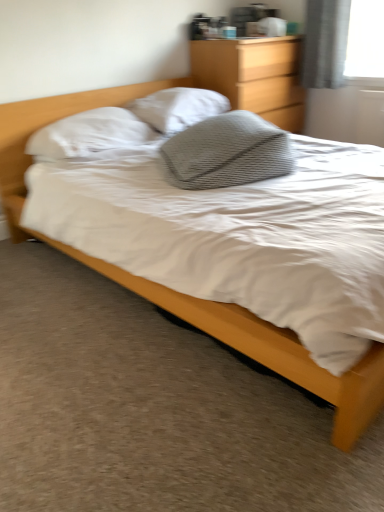
Locate an element on the screen. This screenshot has width=384, height=512. white textured pillow at center, arranged as the 1th pillow when viewed from the back is located at coordinates (178, 108).

From the image's perspective, is white textured pillow at center, which is the 3th pillow in front-to-back order, on matte wood bed at center?

Yes, from the image's perspective, white textured pillow at center, which is the 3th pillow in front-to-back order, is above matte wood bed at center.

There is a matte wood bed at center. Where is `the 3rd pillow above it (from a real-world perspective)`? Image resolution: width=384 pixels, height=512 pixels. the 3rd pillow above it (from a real-world perspective) is located at coordinates (178, 108).

Between white textured pillow at center, arranged as the 1th pillow when viewed from the back, and matte wood bed at center, which one is positioned in front?

matte wood bed at center is in front.

Between point (200, 89) and point (297, 344), which one is positioned in front?

Positioned in front is point (297, 344).

Is gray textured pillow at center, which is counted as the 1th pillow, starting from the front, located outside matte wood bed at center?

No, most part of gray textured pillow at center, which is counted as the 1th pillow, starting from the front, lies within matte wood bed at center.

From the image's perspective, relative to matte wood bed at center, is gray textured pillow at center, the third pillow when ordered from back to front, above or below?

gray textured pillow at center, the third pillow when ordered from back to front, is situated higher than matte wood bed at center in the image.

From a real-world perspective, is gray textured pillow at center, the third pillow when ordered from back to front, positioned over matte wood bed at center based on gravity?

Yes, from a real-world perspective, gray textured pillow at center, the third pillow when ordered from back to front, is on top of matte wood bed at center.

Is the depth of gray textured pillow at center, the third pillow when ordered from back to front, greater than that of matte wood bed at center?

Yes, the depth of gray textured pillow at center, the third pillow when ordered from back to front, is greater than that of matte wood bed at center.

Are matte wood bed at center and white textured pillow at center, arranged as the 1th pillow when viewed from the back, located far from each other?

Indeed, matte wood bed at center is not near white textured pillow at center, arranged as the 1th pillow when viewed from the back.

From a real-world perspective, which object stands above the other?

white textured pillow at center, which is the 3th pillow in front-to-back order, is physically above.

Is matte wood bed at center to the left of white textured pillow at center, which is the 3th pillow in front-to-back order, from the viewer's perspective?

No, matte wood bed at center is not to the left of white textured pillow at center, which is the 3th pillow in front-to-back order.

What's the angular difference between wooden dresser at upper center and gray textured pillow at center, which is counted as the 1th pillow, starting from the front,'s facing directions?

They differ by 20 degrees in their facing directions.

Is gray textured pillow at center, which is counted as the 1th pillow, starting from the front, completely or partially inside wooden dresser at upper center?

No.

Between wooden dresser at upper center and gray textured pillow at center, which is counted as the 1th pillow, starting from the front, which one has smaller width?

With smaller width is wooden dresser at upper center.

Is wooden dresser at upper center turned away from gray textured pillow at center, which is counted as the 1th pillow, starting from the front?

That's not correct — wooden dresser at upper center is not looking away from gray textured pillow at center, which is counted as the 1th pillow, starting from the front.

Which is farther from the camera, (191, 312) or (175, 139)?

The point (175, 139) is behind.

From a real-world perspective, is matte wood bed at center positioned over gray textured pillow at center, the third pillow when ordered from back to front, based on gravity?

Actually, matte wood bed at center is physically below gray textured pillow at center, the third pillow when ordered from back to front, in the real world.

Looking at this image, considering the relative sizes of matte wood bed at center and gray textured pillow at center, the third pillow when ordered from back to front, in the image provided, is matte wood bed at center bigger than gray textured pillow at center, the third pillow when ordered from back to front,?

Indeed, matte wood bed at center has a larger size compared to gray textured pillow at center, the third pillow when ordered from back to front.

This screenshot has width=384, height=512. Identify the location of bed beneath the gray textured pillow at center, which is counted as the 1th pillow, starting from the front (from a real-world perspective). (186, 295).

Could you tell me if gray textured pillow at center, the third pillow when ordered from back to front, is facing wooden dresser at upper center?

No, gray textured pillow at center, the third pillow when ordered from back to front, is not aimed at wooden dresser at upper center.

Which of these two, gray textured pillow at center, which is counted as the 1th pillow, starting from the front, or wooden dresser at upper center, is bigger?

wooden dresser at upper center is bigger.

Can you confirm if gray textured pillow at center, which is counted as the 1th pillow, starting from the front, is thinner than wooden dresser at upper center?

Incorrect, the width of gray textured pillow at center, which is counted as the 1th pillow, starting from the front, is not less than that of wooden dresser at upper center.

What's the angular difference between gray textured pillow at center, the third pillow when ordered from back to front, and wooden dresser at upper center's facing directions?

There is a 20-degree angle between the facing directions of gray textured pillow at center, the third pillow when ordered from back to front, and wooden dresser at upper center.

Can you tell me how much matte wood bed at center and wooden dresser at upper center differ in facing direction?

matte wood bed at center and wooden dresser at upper center are facing 0.83 degrees away from each other.

Who is smaller, matte wood bed at center or wooden dresser at upper center?

wooden dresser at upper center.

Which is in front, point (48, 116) or point (296, 110)?

The point (48, 116) is more forward.

In terms of width, does matte wood bed at center look wider or thinner when compared to wooden dresser at upper center?

matte wood bed at center is wider than wooden dresser at upper center.

Locate an element on the screen. The height and width of the screenshot is (512, 384). bed lying below the white textured pillow at center, arranged as the 1th pillow when viewed from the back (from the image's perspective) is located at coordinates (186, 295).

Identify the location of bed below the gray textured pillow at center, the third pillow when ordered from back to front (from a real-world perspective). (186, 295).

When comparing their distances from white soft pillow at upper left, which is counted as the 2th pillow, starting from the back, does gray textured pillow at center, the third pillow when ordered from back to front, or matte wood bed at center seem further?

Among the two, matte wood bed at center is located further to white soft pillow at upper left, which is counted as the 2th pillow, starting from the back.

When comparing their distances from wooden dresser at upper center, does matte wood bed at center or white textured pillow at center, arranged as the 1th pillow when viewed from the back, seem further?

Among the two, matte wood bed at center is located further to wooden dresser at upper center.

Estimate the real-world distances between objects in this image. Which object is further from white textured pillow at center, which is the 3th pillow in front-to-back order, wooden dresser at upper center or matte wood bed at center?

matte wood bed at center is positioned further to the anchor white textured pillow at center, which is the 3th pillow in front-to-back order.

In the scene shown: When comparing their distances from wooden dresser at upper center, does matte wood bed at center or white soft pillow at upper left, which is counted as the 2th pillow, starting from the back, seem closer?

Among the two, white soft pillow at upper left, which is counted as the 2th pillow, starting from the back, is located nearer to wooden dresser at upper center.

Considering their positions, is gray textured pillow at center, the third pillow when ordered from back to front, positioned closer to matte wood bed at center than wooden dresser at upper center?

gray textured pillow at center, the third pillow when ordered from back to front.

Estimate the real-world distances between objects in this image. Which object is further from white soft pillow at upper left, which is counted as the 2th pillow, starting from the back, white textured pillow at center, which is the 3th pillow in front-to-back order, or matte wood bed at center?

Based on the image, matte wood bed at center appears to be further to white soft pillow at upper left, which is counted as the 2th pillow, starting from the back.

Considering their positions, is wooden dresser at upper center positioned closer to white soft pillow at upper left, which ranks as the 2th pillow in front-to-back order, than matte wood bed at center?

matte wood bed at center is positioned closer to the anchor white soft pillow at upper left, which ranks as the 2th pillow in front-to-back order.

Looking at the image, which one is located further to white soft pillow at upper left, which is counted as the 2th pillow, starting from the back, gray textured pillow at center, the third pillow when ordered from back to front, or wooden dresser at upper center?

Based on the image, wooden dresser at upper center appears to be further to white soft pillow at upper left, which is counted as the 2th pillow, starting from the back.

Where is `pillow located between matte wood bed at center and white soft pillow at upper left, which is counted as the 2th pillow, starting from the back, in the depth direction`? The height and width of the screenshot is (512, 384). pillow located between matte wood bed at center and white soft pillow at upper left, which is counted as the 2th pillow, starting from the back, in the depth direction is located at coordinates (226, 152).

Identify the location of pillow between gray textured pillow at center, which is counted as the 1th pillow, starting from the front, and white textured pillow at center, which is the 3th pillow in front-to-back order, in the front-back direction. This screenshot has height=512, width=384. (89, 134).